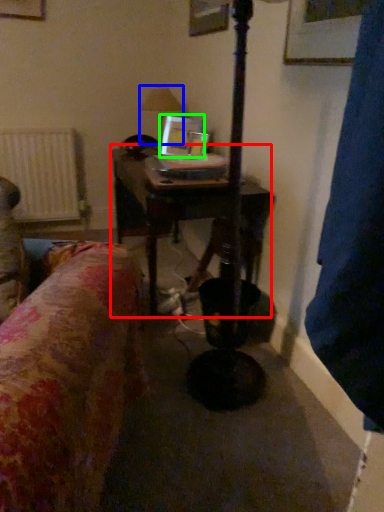
Question: Considering the real-world distances, which object is closest to table (highlighted by a red box)? table lamp (highlighted by a blue box) or picture frame (highlighted by a green box).

Choices:
 (A) table lamp
 (B) picture frame

Answer: (B)